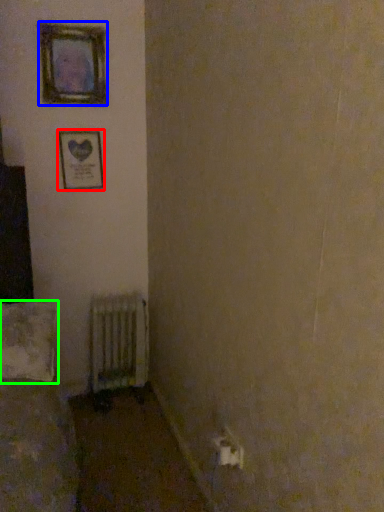
Question: Which is nearer to the picture frame (highlighted by a red box)? picture frame (highlighted by a blue box) or pillow (highlighted by a green box).

Choices:
 (A) picture frame
 (B) pillow

Answer: (A)